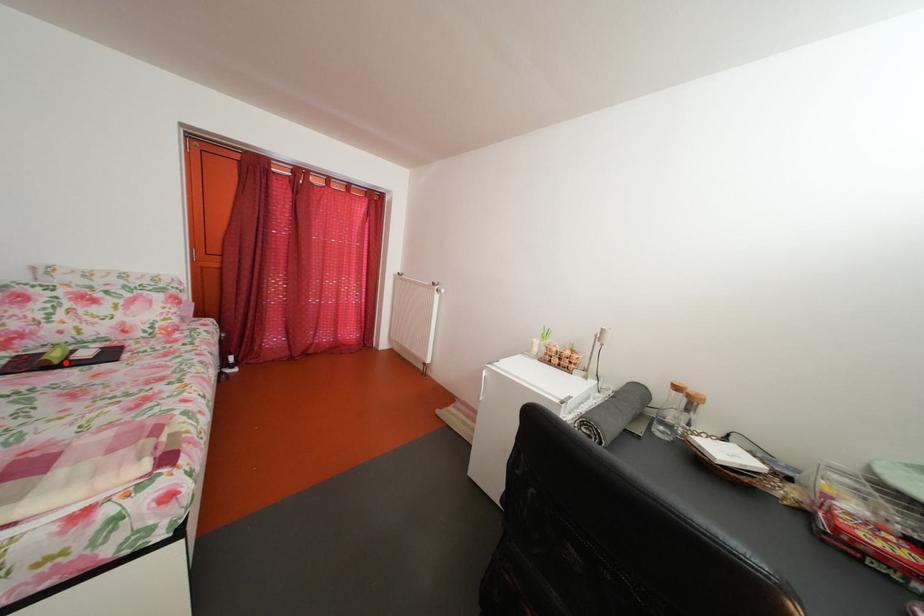
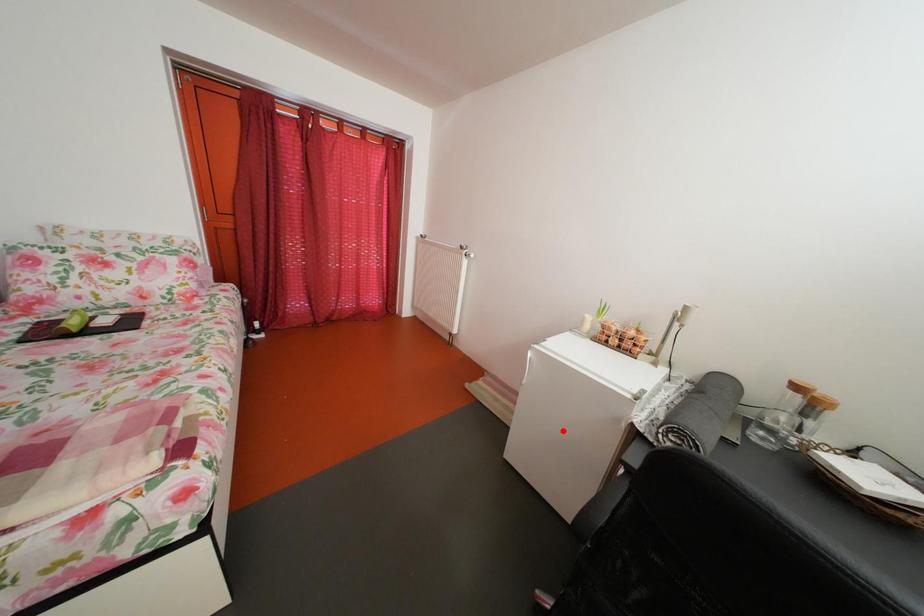
I am providing you with two images of the same scene from different viewpoints. A red point is marked on the first image and another point is marked on the second image. Do the highlighted points in image1 and image2 indicate the same real-world spot?

No